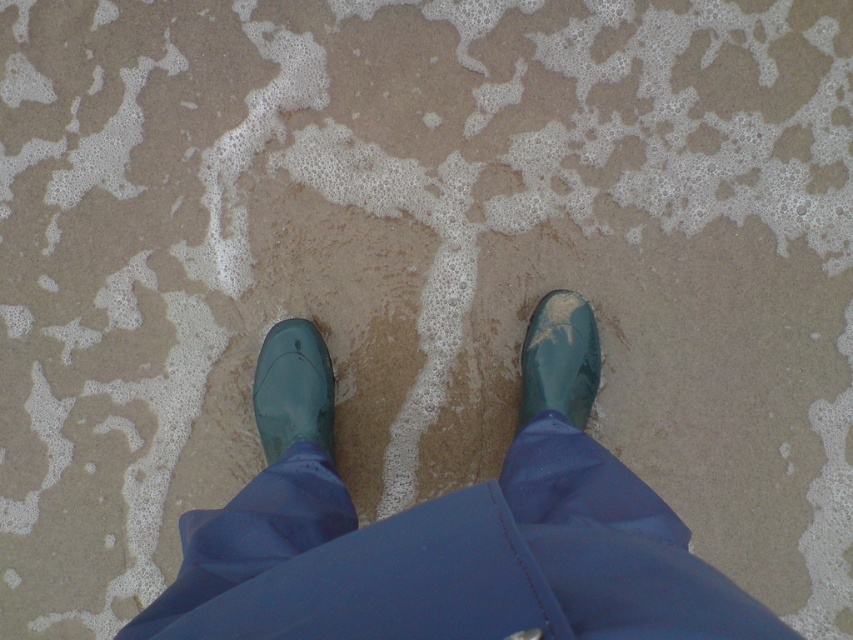
You are a photographer trying to capture the reflection of the green rubber boots at center and the glossy rubber boot at lower left in the water. Which boot should you focus on to get the clearest reflection?

The glossy rubber boot at lower left will have a clearer reflection because it is positioned higher and closer to the water surface compared to the green rubber boots at center, which are lower and farther away.

You are a photographer trying to capture the reflection of the green rubber boots at center and the glossy rubber boot at lower left in the surrounding water. Which boot will have a larger reflection in the water?

The green rubber boots at center will have a larger reflection in the water because it is bigger than the glossy rubber boot at lower left.

You need to choose between the green rubber boots at center and the glossy rubber boot at lower right to protect your feet from the rough sandy surface. Which pair offers better protection based on their size?

The green rubber boots at center is bigger than glossy rubber boot at lower right, so the green rubber boots at center offers better protection as larger boots typically cover more of the foot and provide better protection against rough surfaces.